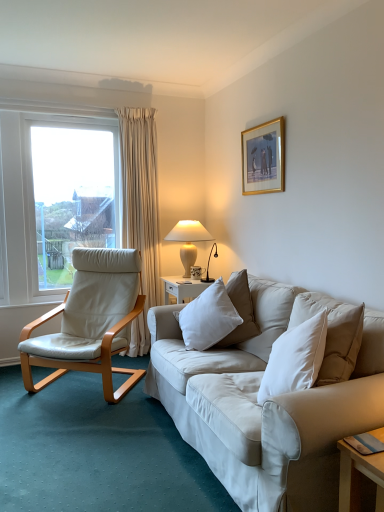
Question: Is white ceramic table lamp at upper right positioned with its back to white soft pillow at center?

Choices:
 (A) yes
 (B) no

Answer: (B)

Question: Is white soft pillow at center inside white ceramic table lamp at upper right?

Choices:
 (A) yes
 (B) no

Answer: (B)

Question: Is white ceramic table lamp at upper right taller than white soft pillow at center?

Choices:
 (A) yes
 (B) no

Answer: (A)

Question: Is white ceramic table lamp at upper right far from white soft pillow at center?

Choices:
 (A) yes
 (B) no

Answer: (A)

Question: From a real-world perspective, is white ceramic table lamp at upper right on top of white soft pillow at center?

Choices:
 (A) yes
 (B) no

Answer: (A)

Question: Do you think white soft pillow at center is within gold/glossy picture frame at upper center, or outside of it?

Choices:
 (A) inside
 (B) outside

Answer: (B)

Question: Considering the positions of white soft pillow at center and gold/glossy picture frame at upper center in the image, is white soft pillow at center wider or thinner than gold/glossy picture frame at upper center?

Choices:
 (A) thin
 (B) wide

Answer: (B)

Question: From the image's perspective, is white soft pillow at center located above or below gold/glossy picture frame at upper center?

Choices:
 (A) above
 (B) below

Answer: (B)

Question: In terms of size, does white soft pillow at center appear bigger or smaller than gold/glossy picture frame at upper center?

Choices:
 (A) small
 (B) big

Answer: (B)

Question: Is point (195, 233) positioned closer to the camera than point (273, 158)?

Choices:
 (A) closer
 (B) farther

Answer: (B)

Question: Would you say white ceramic table lamp at upper right is inside or outside gold/glossy picture frame at upper center?

Choices:
 (A) inside
 (B) outside

Answer: (B)

Question: Considering the positions of white ceramic table lamp at upper right and gold/glossy picture frame at upper center in the image, is white ceramic table lamp at upper right taller or shorter than gold/glossy picture frame at upper center?

Choices:
 (A) tall
 (B) short

Answer: (B)

Question: In the image, is white ceramic table lamp at upper right on the left side or the right side of gold/glossy picture frame at upper center?

Choices:
 (A) left
 (B) right

Answer: (A)

Question: Relative to white ceramic table lamp at upper right, is gold/glossy picture frame at upper center in front or behind?

Choices:
 (A) front
 (B) behind

Answer: (A)

Question: From the image's perspective, is gold/glossy picture frame at upper center positioned above or below white ceramic table lamp at upper right?

Choices:
 (A) above
 (B) below

Answer: (A)